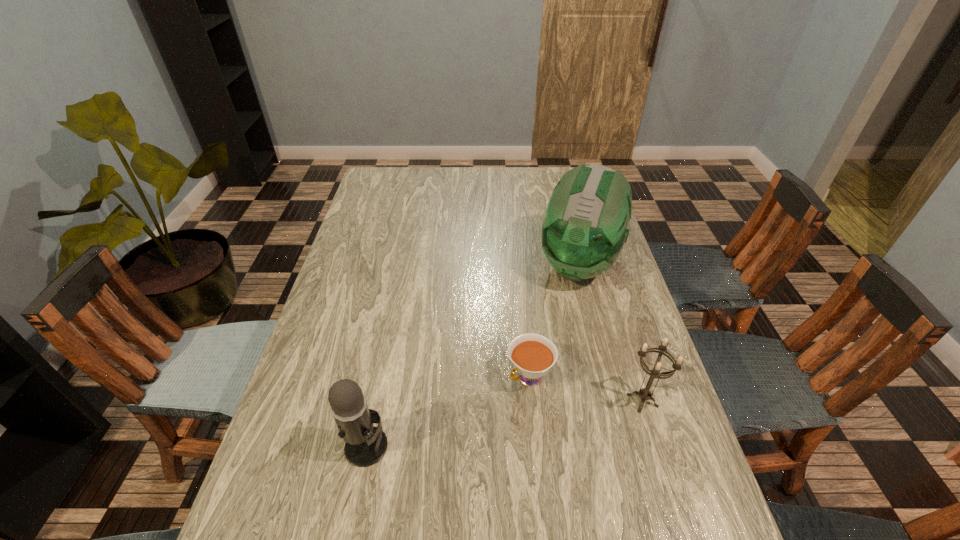
At what (x,y) coordinates should I click in order to perform the action: click on blank space located on the visor of the football helmet. Please return your answer as a coordinate pair (x, y). The image size is (960, 540). Looking at the image, I should click on (561, 317).

This screenshot has width=960, height=540. Find the location of `vacant area situated 0.370m on the side of the teacup with the handle`. vacant area situated 0.370m on the side of the teacup with the handle is located at coordinates (387, 502).

You are a GUI agent. You are given a task and a screenshot of the screen. Output one action in this format:
    pyautogui.click(x=<x>, y=<y>)
    Task: Click on the free space located 0.280m on the side of the teacup with the handle
    The height and width of the screenshot is (540, 960).
    Given the screenshot: What is the action you would take?
    pyautogui.click(x=422, y=470)

Identify the location of blank area located 0.190m on the side of the teacup with the handle. This screenshot has width=960, height=540. [x=454, y=442].

The width and height of the screenshot is (960, 540). What are the coordinates of `object located in the left edge section of the desktop` in the screenshot? It's located at (365, 445).

You are a GUI agent. You are given a task and a screenshot of the screen. Output one action in this format:
    pyautogui.click(x=<x>, y=<y>)
    Task: Click on the candle holder that is at the right edge
    This screenshot has width=960, height=540.
    Given the screenshot: What is the action you would take?
    point(644,393)

This screenshot has height=540, width=960. Identify the location of football helmet at the right edge. (584, 228).

In the image, there is a desktop. Where is `free space at the far edge`? Image resolution: width=960 pixels, height=540 pixels. free space at the far edge is located at coordinates click(x=534, y=173).

The image size is (960, 540). In order to click on vacant space at the left edge of the desktop in this screenshot , I will do `click(333, 343)`.

Image resolution: width=960 pixels, height=540 pixels. In the image, there is a desktop. Identify the location of vacant space at the right edge. (588, 284).